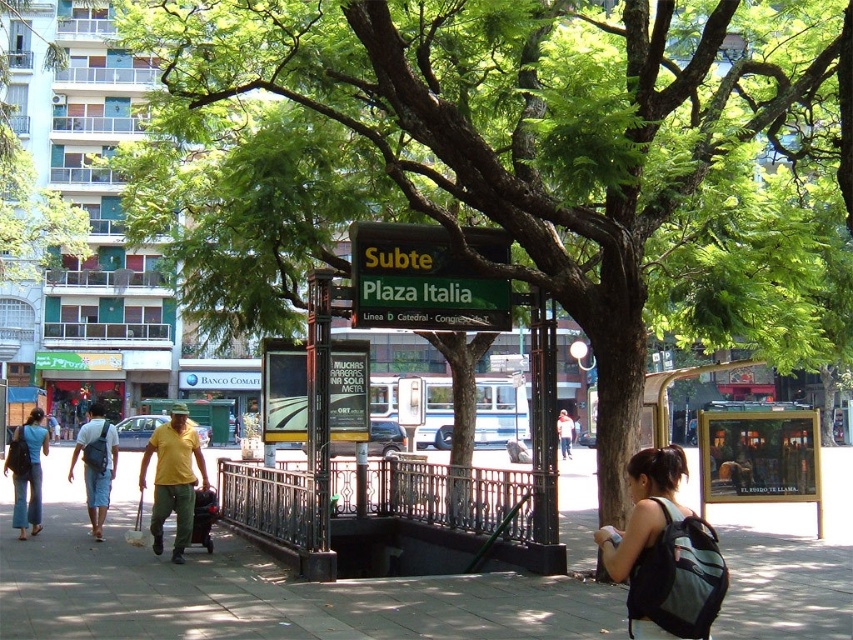
You are standing at the subway entrance and want to take a photo of both point (357,256) and point (7,470) in the scene. Which point should you focus on first to ensure both are in clear view?

You should focus on point (357,256) first because it is closer to the camera, ensuring both points are in focus when using a camera with a fixed focal length.

You are a delivery person with a 2.5 meter wide cart. You need to navigate between the green matte sign at center and the light blue jeans at center. Can your cart fit through the space between them?

The distance between the green matte sign at center and the light blue jeans at center is 3.92 meters, so the cart with 2.5 meters width can fit through the space between them since it is wider than the cart.

Consider the image. You are a tourist standing at the subway entrance and see the green matte sign at center and the light blue jeans at center. Which object is positioned to the left?

The green matte sign at center is to the left of the light blue jeans at center.